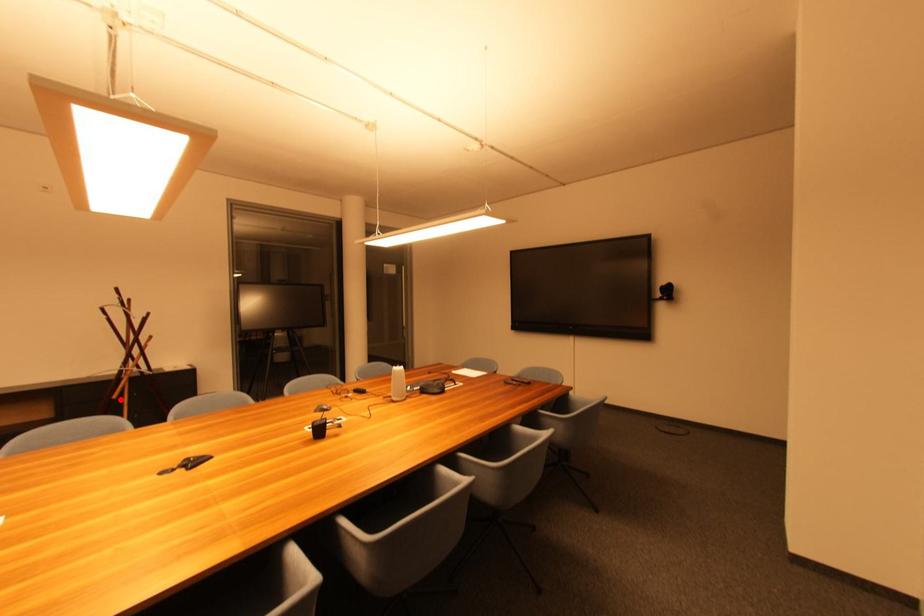
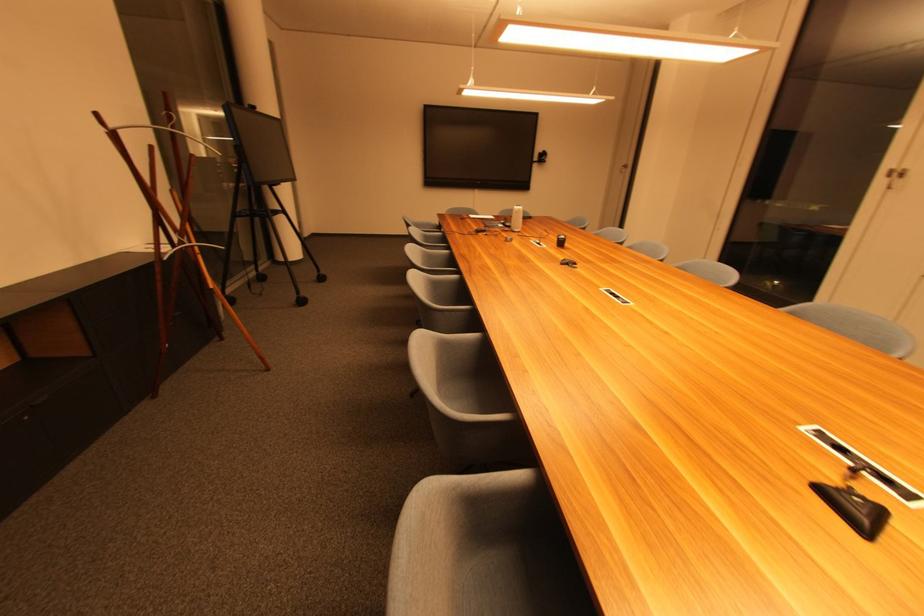
Question: I am providing you with two images of the same scene from different viewpoints. A red point is shown in image1. For the corresponding object point in image2, is it positioned nearer or farther from the camera?

Choices:
 (A) Nearer
 (B) Farther

Answer: (A)